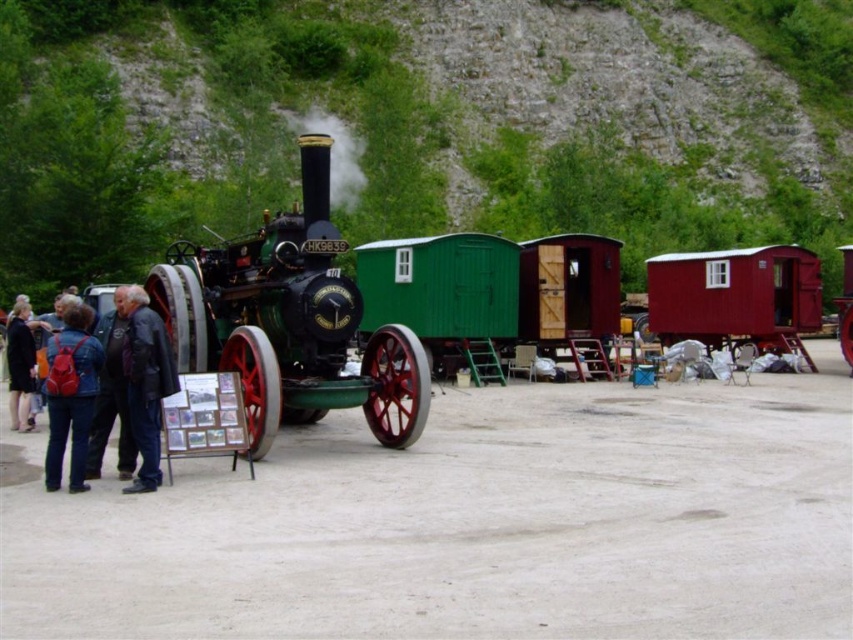
You are standing in front of the vintage steam traction engine and want to place a black leather jacket at lower left on the smooth wooden cabin at right. Can you reach the cabin from your current position without moving the engine?

The smooth wooden cabin at right is further to the viewer than the black leather jacket at lower left, so you can reach it without moving the engine.

You are a delivery person who needs to place a large package that is 1.2 meters wide. You see the smooth wooden cabin at right and the red backpack at lower left. Which object can the package fit next to without overlapping?

The smooth wooden cabin at right has a width larger than the red backpack at lower left, so the package can fit next to the smooth wooden cabin at right.